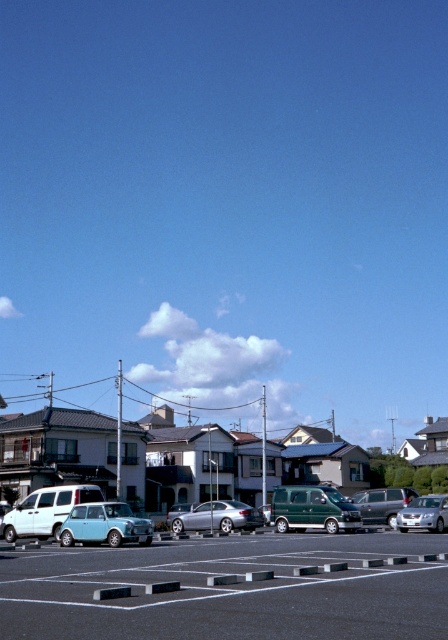
Does black asphalt parking lot at lower center have a larger size compared to green matte van at center?

Yes, black asphalt parking lot at lower center is bigger than green matte van at center.

Is point (27, 636) farther from camera compared to point (280, 492)?

No.

Image resolution: width=448 pixels, height=640 pixels. What are the coordinates of `black asphalt parking lot at lower center` in the screenshot? It's located at (229, 589).

Can you confirm if black asphalt parking lot at lower center is shorter than metallic silver sedan at center?

Yes, black asphalt parking lot at lower center is shorter than metallic silver sedan at center.

In the scene shown: Which of these two, black asphalt parking lot at lower center or metallic silver sedan at center, stands taller?

metallic silver sedan at center is taller.

Between point (244, 570) and point (366, 496), which one is positioned in front?

Point (244, 570) is more forward.

You are a GUI agent. You are given a task and a screenshot of the screen. Output one action in this format:
    pyautogui.click(x=<x>, y=<y>)
    Task: Click on the black asphalt parking lot at lower center
    Image resolution: width=448 pixels, height=640 pixels.
    Given the screenshot: What is the action you would take?
    pyautogui.click(x=229, y=589)

Which of these two, green matte van at center or satin silver sedan at center, stands taller?

With more height is satin silver sedan at center.

Between green matte van at center and satin silver sedan at center, which one appears on the left side from the viewer's perspective?

Positioned to the left is satin silver sedan at center.

Which is behind, point (340, 500) or point (193, 524)?

The point (193, 524) is more distant.

You are a GUI agent. You are given a task and a screenshot of the screen. Output one action in this format:
    pyautogui.click(x=<x>, y=<y>)
    Task: Click on the green matte van at center
    Image resolution: width=448 pixels, height=640 pixels.
    Given the screenshot: What is the action you would take?
    pyautogui.click(x=311, y=509)